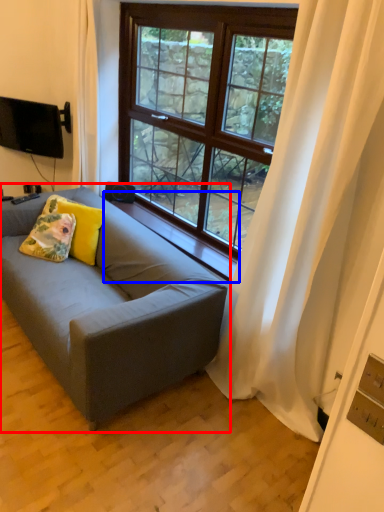
Question: Which point is closer to the camera, studio couch (highlighted by a red box) or window sill (highlighted by a blue box)?

Choices:
 (A) studio couch
 (B) window sill

Answer: (A)